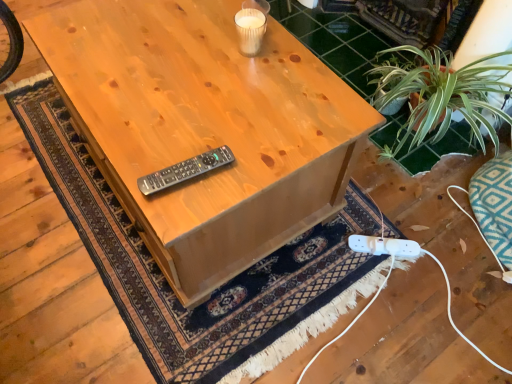
Identify the location of vacant area that is situated to the right of black plastic remote at center. (249, 162).